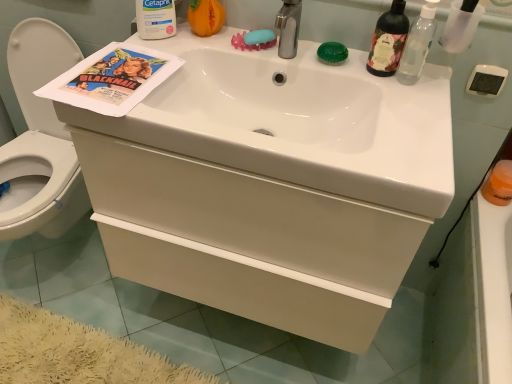
Question: Can you confirm if translucent glass bottle at upper right, which is the 2th bottle in right-to-left order, is shorter than blue rubber soap at upper center, the 1th soap positioned from the left?

Choices:
 (A) no
 (B) yes

Answer: (A)

Question: Is blue rubber soap at upper center, the 1th soap positioned from the left, located within translucent glass bottle at upper right, which is the 2th bottle in right-to-left order?

Choices:
 (A) no
 (B) yes

Answer: (A)

Question: Is translucent glass bottle at upper right, which is the 2th bottle in right-to-left order, looking in the opposite direction of blue rubber soap at upper center, which ranks as the 2th soap in right-to-left order?

Choices:
 (A) yes
 (B) no

Answer: (B)

Question: Does translucent glass bottle at upper right, which is the 2th bottle in right-to-left order, come in front of blue rubber soap at upper center, which ranks as the 2th soap in right-to-left order?

Choices:
 (A) no
 (B) yes

Answer: (B)

Question: Does translucent glass bottle at upper right, the second bottle in the left-to-right sequence, have a greater height compared to blue rubber soap at upper center, the 1th soap positioned from the left?

Choices:
 (A) yes
 (B) no

Answer: (A)

Question: From a real-world perspective, is translucent glass bottle at upper right, which is the 2th bottle in right-to-left order, located beneath blue rubber soap at upper center, the 1th soap positioned from the left?

Choices:
 (A) yes
 (B) no

Answer: (B)

Question: Can you confirm if green translucent soap at upper center, which is counted as the 1th soap, starting from the right, is wider than white matte drawer at center?

Choices:
 (A) no
 (B) yes

Answer: (A)

Question: Is white matte drawer at center at the back of green translucent soap at upper center, which is counted as the 1th soap, starting from the right?

Choices:
 (A) yes
 (B) no

Answer: (B)

Question: Can you see green translucent soap at upper center, which is counted as the 1th soap, starting from the right, touching white matte drawer at center?

Choices:
 (A) no
 (B) yes

Answer: (A)

Question: Does green translucent soap at upper center, the second soap viewed from the left, appear on the left side of white matte drawer at center?

Choices:
 (A) no
 (B) yes

Answer: (A)

Question: Can you confirm if green translucent soap at upper center, the second soap viewed from the left, is bigger than white matte drawer at center?

Choices:
 (A) yes
 (B) no

Answer: (B)

Question: From the image's perspective, is green translucent soap at upper center, the second soap viewed from the left, below white matte drawer at center?

Choices:
 (A) no
 (B) yes

Answer: (A)

Question: Is white glossy sink at center further to camera compared to transparent plastic bottle at upper right, which is counted as the third bottle, starting from the left?

Choices:
 (A) no
 (B) yes

Answer: (A)